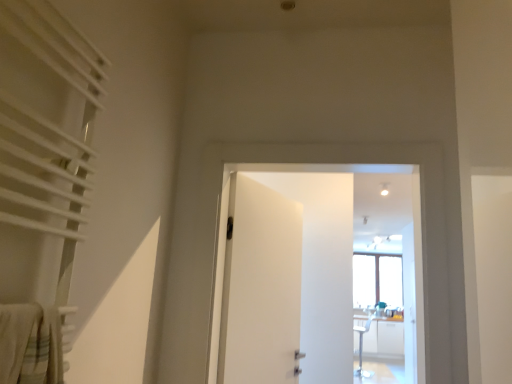
In order to face white matte door at center, which ranks as the 1th door in left-to-right order, should I rotate leftwards or rightwards?

You should rotate left by 0.300 degrees.

What do you see at coordinates (421, 214) in the screenshot?
I see `white matte door at center, the 2th door from the left` at bounding box center [421, 214].

Find the location of a particular element. Image resolution: width=512 pixels, height=384 pixels. white textured curtain at left is located at coordinates (41, 179).

Consider the image. From the image's perspective, is white matte door at center, placed as the 1th door when sorted from right to left, positioned above or below white matte door at center, which ranks as the 1th door in left-to-right order?

white matte door at center, placed as the 1th door when sorted from right to left, is situated higher than white matte door at center, which ranks as the 1th door in left-to-right order, in the image.

Measure the distance from white matte door at center, the 2th door from the left, to white matte door at center, positioned as the second door in right-to-left order.

white matte door at center, the 2th door from the left, and white matte door at center, positioned as the second door in right-to-left order, are 21.56 inches apart.

Based on the photo, is white matte door at center, the 2th door from the left, far from white matte door at center, positioned as the second door in right-to-left order?

That's not correct — white matte door at center, the 2th door from the left, is a little close to white matte door at center, positioned as the second door in right-to-left order.

Does white matte door at center, placed as the 1th door when sorted from right to left, have a larger size compared to white matte door at center, which ranks as the 1th door in left-to-right order?

Yes, white matte door at center, placed as the 1th door when sorted from right to left, is bigger than white matte door at center, which ranks as the 1th door in left-to-right order.

Between point (25, 206) and point (287, 327), which one is positioned behind?

The point (287, 327) is more distant.

Is white textured curtain at left to the right of white matte door at center, positioned as the second door in right-to-left order, from the viewer's perspective?

No, white textured curtain at left is not to the right of white matte door at center, positioned as the second door in right-to-left order.

In the scene shown: Are white textured curtain at left and white matte door at center, positioned as the second door in right-to-left order, located far from each other?

white textured curtain at left is positioned a significant distance from white matte door at center, positioned as the second door in right-to-left order.

Is white matte door at center, positioned as the second door in right-to-left order, surrounded by white textured curtain at left?

No, white textured curtain at left does not contain white matte door at center, positioned as the second door in right-to-left order.

This screenshot has height=384, width=512. In order to click on the 2nd door counting from the right of the white textured curtain at left in this screenshot , I will do `click(421, 214)`.

Could you tell me if white matte door at center, the 2th door from the left, is turned towards white textured curtain at left?

Yes, white matte door at center, the 2th door from the left, is aimed at white textured curtain at left.

From a real-world perspective, is white matte door at center, placed as the 1th door when sorted from right to left, physically above white textured curtain at left?

Actually, white matte door at center, placed as the 1th door when sorted from right to left, is physically below white textured curtain at left in the real world.

Considering the sizes of objects white matte door at center, which ranks as the 1th door in left-to-right order, and white matte door at center, placed as the 1th door when sorted from right to left, in the image provided, who is smaller, white matte door at center, which ranks as the 1th door in left-to-right order, or white matte door at center, placed as the 1th door when sorted from right to left,?

With smaller size is white matte door at center, which ranks as the 1th door in left-to-right order.

Is white matte door at center, positioned as the second door in right-to-left order, taller than white matte door at center, placed as the 1th door when sorted from right to left?

No, white matte door at center, positioned as the second door in right-to-left order, is not taller than white matte door at center, placed as the 1th door when sorted from right to left.

Which of these two, white matte door at center, positioned as the second door in right-to-left order, or white matte door at center, the 2th door from the left, is wider?

Wider between the two is white matte door at center, the 2th door from the left.

Who is taller, white textured curtain at left or white matte door at center, the 2th door from the left?

With more height is white matte door at center, the 2th door from the left.

Which is more to the left, white textured curtain at left or white matte door at center, the 2th door from the left?

From the viewer's perspective, white textured curtain at left appears more on the left side.

Does white textured curtain at left touch white matte door at center, the 2th door from the left?

No.

From the picture: From a real-world perspective, between white textured curtain at left and white matte door at center, placed as the 1th door when sorted from right to left, who is vertically higher?

From a 3D spatial view, white textured curtain at left is above.

From a real-world perspective, is white matte door at center, which ranks as the 1th door in left-to-right order, positioned over white textured curtain at left based on gravity?

No, from a real-world perspective, white matte door at center, which ranks as the 1th door in left-to-right order, is not on top of white textured curtain at left.

Is white matte door at center, positioned as the second door in right-to-left order, in front of white textured curtain at left?

No, white matte door at center, positioned as the second door in right-to-left order, is further to the viewer.

From the image's perspective, is white matte door at center, positioned as the second door in right-to-left order, located above white textured curtain at left?

No, from the image's perspective, white matte door at center, positioned as the second door in right-to-left order, is not on top of white textured curtain at left.

This screenshot has width=512, height=384. What are the coordinates of `door above the white matte door at center, which ranks as the 1th door in left-to-right order (from the image's perspective)` in the screenshot? It's located at (421, 214).

The width and height of the screenshot is (512, 384). Identify the location of door that is the 1st object to the right of the white textured curtain at left, starting at the anchor. (261, 286).

Looking at this image, based on their spatial positions, is white matte door at center, placed as the 1th door when sorted from right to left, or white matte door at center, which ranks as the 1th door in left-to-right order, further from white textured curtain at left?

Among the two, white matte door at center, which ranks as the 1th door in left-to-right order, is located further to white textured curtain at left.

Looking at the image, which one is located further to white textured curtain at left, white matte door at center, which ranks as the 1th door in left-to-right order, or white matte door at center, placed as the 1th door when sorted from right to left?

Based on the image, white matte door at center, which ranks as the 1th door in left-to-right order, appears to be further to white textured curtain at left.

From the image, which object appears to be farther from white matte door at center, the 2th door from the left, white textured curtain at left or white matte door at center, positioned as the second door in right-to-left order?

Based on the image, white textured curtain at left appears to be further to white matte door at center, the 2th door from the left.

When comparing their distances from white matte door at center, positioned as the second door in right-to-left order, does white matte door at center, the 2th door from the left, or white textured curtain at left seem closer?

Based on the image, white matte door at center, the 2th door from the left, appears to be nearer to white matte door at center, positioned as the second door in right-to-left order.

Considering their positions, is white textured curtain at left positioned closer to white matte door at center, positioned as the second door in right-to-left order, than white matte door at center, the 2th door from the left?

Among the two, white matte door at center, the 2th door from the left, is located nearer to white matte door at center, positioned as the second door in right-to-left order.

Considering their positions, is white matte door at center, positioned as the second door in right-to-left order, positioned closer to white matte door at center, placed as the 1th door when sorted from right to left, than white textured curtain at left?

white matte door at center, positioned as the second door in right-to-left order, is positioned closer to the anchor white matte door at center, placed as the 1th door when sorted from right to left.

Where is `door between white textured curtain at left and white matte door at center, positioned as the second door in right-to-left order, along the z-axis`? This screenshot has height=384, width=512. door between white textured curtain at left and white matte door at center, positioned as the second door in right-to-left order, along the z-axis is located at coordinates [421, 214].